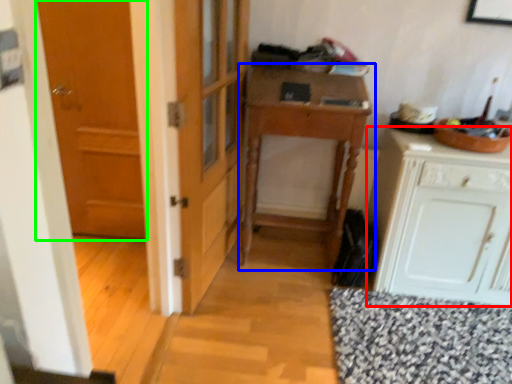
Question: Which is nearer to the cabinetry (highlighted by a red box)? table (highlighted by a blue box) or door (highlighted by a green box).

Choices:
 (A) table
 (B) door

Answer: (A)